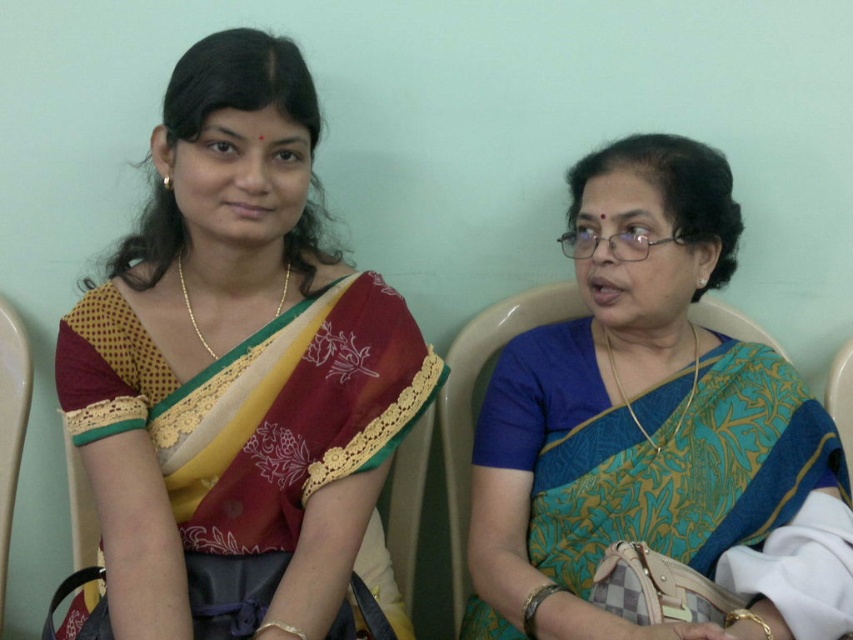
Consider the image. Is matte silk saree at left positioned before blue silk saree at right?

No, matte silk saree at left is further to the viewer.

Where is `matte silk saree at left`? This screenshot has height=640, width=853. matte silk saree at left is located at coordinates (235, 362).

Identify the location of matte silk saree at left. coord(235,362).

Between matte silk saree at left and matte plastic chair at left, which one appears on the left side from the viewer's perspective?

Positioned to the left is matte plastic chair at left.

Which is behind, point (430, 397) or point (4, 321)?

Point (4, 321)

Where is `matte silk saree at left`? The width and height of the screenshot is (853, 640). matte silk saree at left is located at coordinates (235, 362).

In the scene shown: Does blue silk saree at right have a lesser width compared to matte plastic chair at left?

No.

Who is higher up, blue silk saree at right or matte plastic chair at left?

blue silk saree at right is higher up.

You are a GUI agent. You are given a task and a screenshot of the screen. Output one action in this format:
    pyautogui.click(x=<x>, y=<y>)
    Task: Click on the blue silk saree at right
    This screenshot has height=640, width=853.
    Given the screenshot: What is the action you would take?
    click(653, 428)